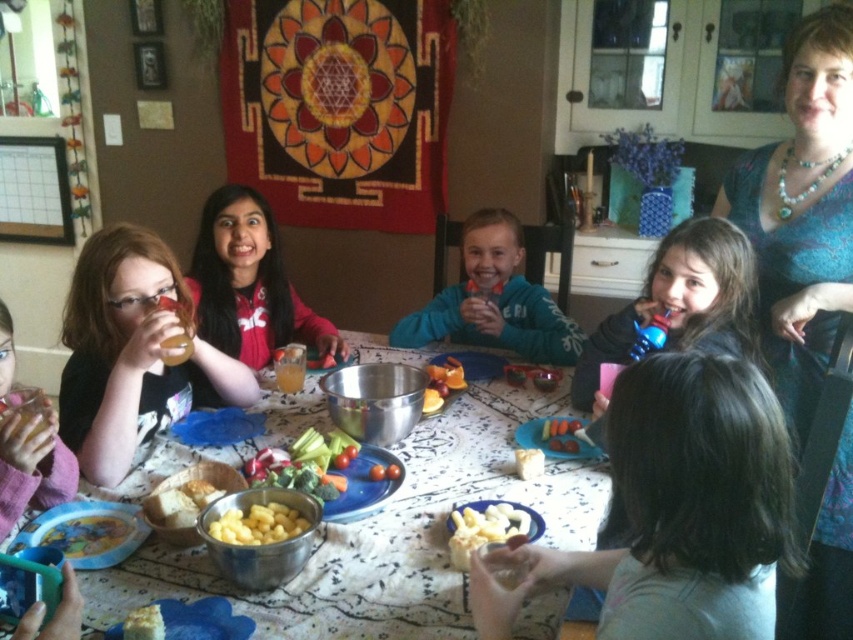
Between point (239, 525) and point (151, 605), which one is positioned behind?

Positioned behind is point (239, 525).

What do you see at coordinates (258, 524) in the screenshot? I see `yellow matte pasta at center` at bounding box center [258, 524].

Where is `yellow matte pasta at center`? yellow matte pasta at center is located at coordinates (258, 524).

Does point (717, 269) lie in front of point (491, 280)?

Yes, it is.

Is point (699, 259) behind point (531, 358)?

No, it is in front of (531, 358).

Does point (744, 252) come closer to viewer compared to point (459, 307)?

Yes.

Identify the location of smooth blue toothbrush at lower right. (682, 301).

Consider the image. Who is positioned more to the right, blue fleece jacket at center or pink fabric bib at lower left?

Positioned to the right is blue fleece jacket at center.

Is blue fleece jacket at center further to the viewer compared to pink fabric bib at lower left?

Yes.

Where is `blue fleece jacket at center`? blue fleece jacket at center is located at coordinates (492, 300).